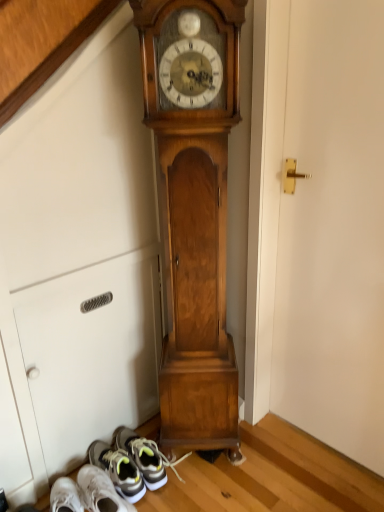
Question: Is white matte door at center right to the left of wooden grandfather clock at center from the viewer's perspective?

Choices:
 (A) no
 (B) yes

Answer: (A)

Question: Does white matte door at center right have a lesser height compared to wooden grandfather clock at center?

Choices:
 (A) yes
 (B) no

Answer: (A)

Question: From the image's perspective, is white matte door at center right above wooden grandfather clock at center?

Choices:
 (A) yes
 (B) no

Answer: (B)

Question: Is wooden grandfather clock at center surrounded by white matte door at center right?

Choices:
 (A) yes
 (B) no

Answer: (B)

Question: From a real-world perspective, is white matte door at center right physically above wooden grandfather clock at center?

Choices:
 (A) yes
 (B) no

Answer: (B)

Question: Does white matte door at center right have a greater width compared to wooden grandfather clock at center?

Choices:
 (A) yes
 (B) no

Answer: (B)

Question: Is wooden grandfather clock at center placed right next to white matte door at center right?

Choices:
 (A) yes
 (B) no

Answer: (B)

Question: Does wooden grandfather clock at center appear on the left side of white matte door at center right?

Choices:
 (A) yes
 (B) no

Answer: (A)

Question: Is wooden grandfather clock at center turned away from white matte door at center right?

Choices:
 (A) no
 (B) yes

Answer: (A)

Question: Is wooden grandfather clock at center positioned beyond the bounds of white matte door at center right?

Choices:
 (A) yes
 (B) no

Answer: (A)

Question: Could you tell me if wooden grandfather clock at center is facing white matte door at center right?

Choices:
 (A) no
 (B) yes

Answer: (A)

Question: Can you confirm if wooden grandfather clock at center is wider than white matte door at center right?

Choices:
 (A) no
 (B) yes

Answer: (B)

Question: From the image's perspective, is gray fabric sneaker at lower left on top of white matte door at center right?

Choices:
 (A) no
 (B) yes

Answer: (A)